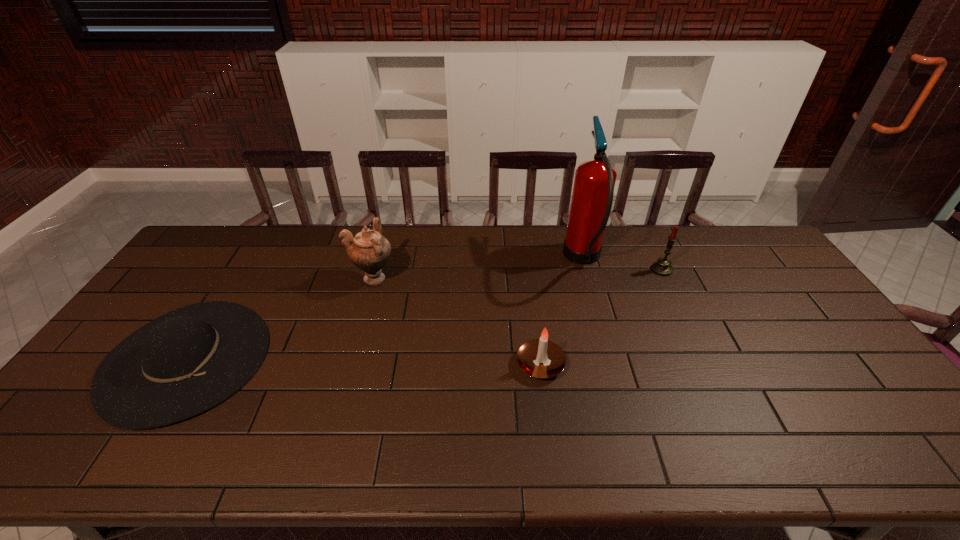
Where is `vacant space that satisfies the following two spatial constraints: 1. on the front side of the fire extinguisher; 2. on the right side of the third shortest object`? The image size is (960, 540). vacant space that satisfies the following two spatial constraints: 1. on the front side of the fire extinguisher; 2. on the right side of the third shortest object is located at coordinates (586, 269).

Find the location of a particular element. Image resolution: width=960 pixels, height=540 pixels. free spot that satisfies the following two spatial constraints: 1. on the front-facing side of the left candle; 2. on the left side of the sombrero is located at coordinates (183, 364).